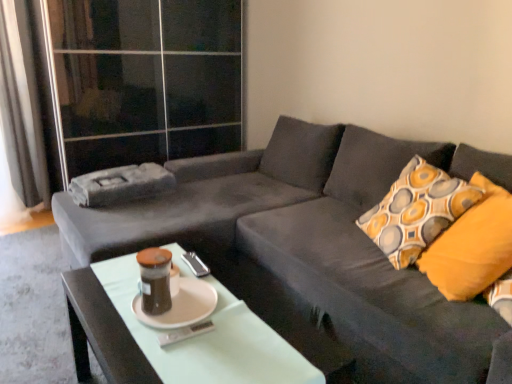
The width and height of the screenshot is (512, 384). I want to click on free space on the front side of teal glass jar at center, so click(x=143, y=348).